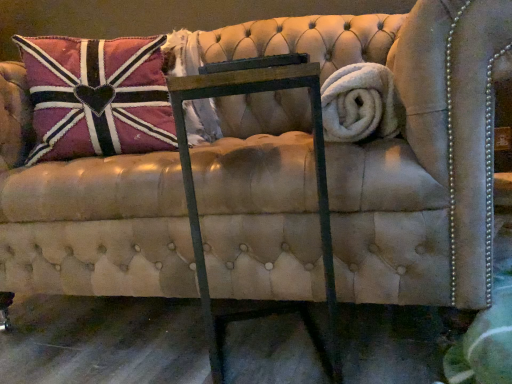
Find the location of `spots to the right of metal frame at center`. spots to the right of metal frame at center is located at coordinates (365, 338).